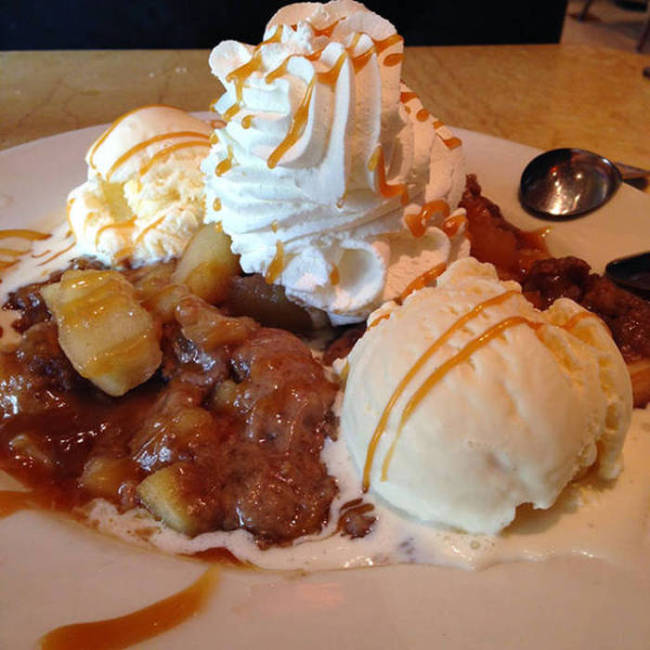
The image size is (650, 650). In order to click on spoon in this screenshot , I will do `click(614, 175)`.